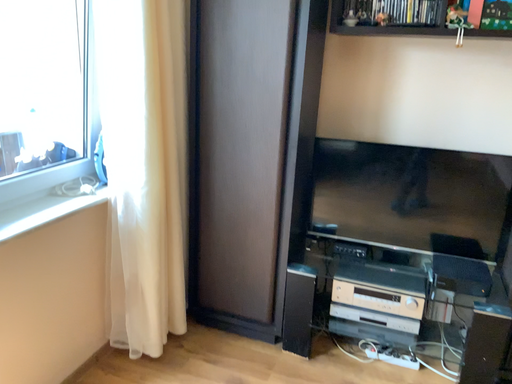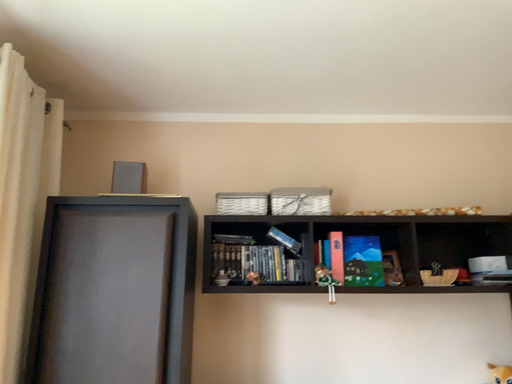
Question: How did the camera likely rotate when shooting the video?

Choices:
 (A) rotated upward
 (B) rotated downward

Answer: (A)